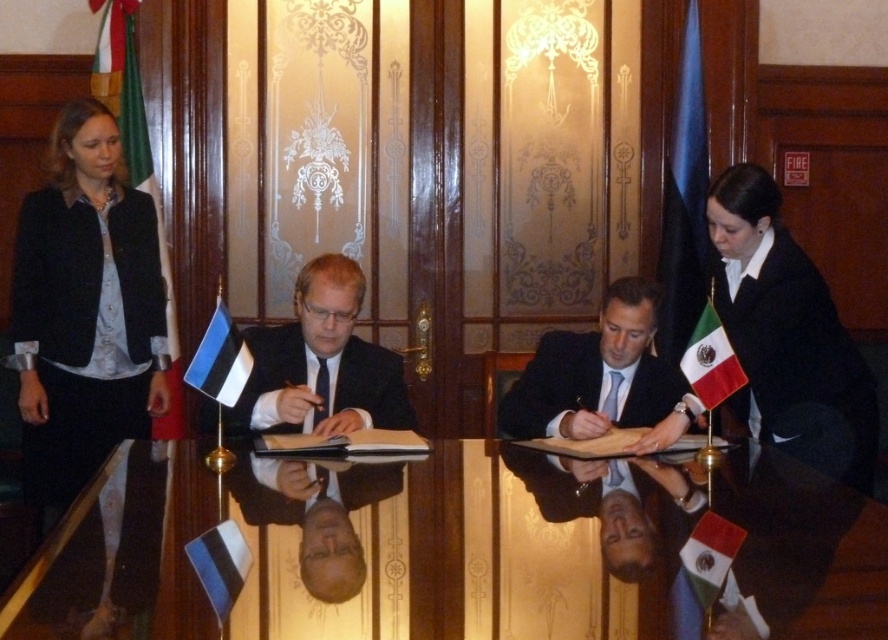
Question: Observing the image, what is the correct spatial positioning of black glossy table at center in reference to silky blue tie at center?

Choices:
 (A) right
 (B) left

Answer: (B)

Question: Does black fabric jacket at left appear over blue-white striped flag at lower left?

Choices:
 (A) no
 (B) yes

Answer: (B)

Question: Based on their relative distances, which object is farther from the dark blue suit at center?

Choices:
 (A) black smooth suit at right
 (B) red fabric flag at lower right
 (C) black fabric jacket at left
 (D) green and white striped flag at lower right

Answer: (C)

Question: Among these points, which one is nearest to the camera?

Choices:
 (A) (392, 628)
 (B) (321, 404)
 (C) (222, 576)
 (D) (644, 369)

Answer: (A)

Question: From the image, what is the correct spatial relationship of black glossy table at center in relation to silky blue tie at center?

Choices:
 (A) below
 (B) above

Answer: (A)

Question: Considering the real-world distances, which object is farthest from the black matte suit at center?

Choices:
 (A) whiteflag at left
 (B) black glossy table at center

Answer: (B)